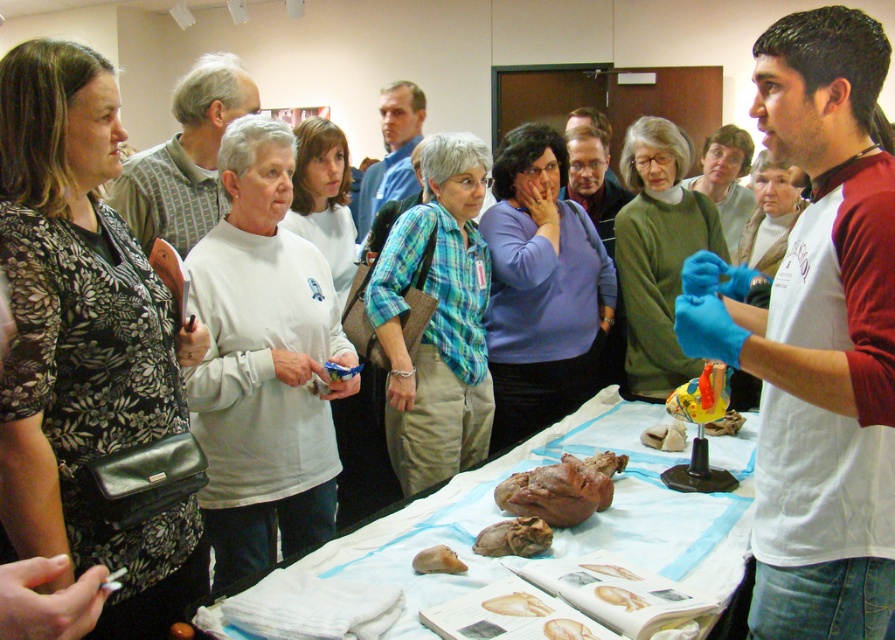
Question: Based on their relative distances, which object is farther from the brown matte bread at center?

Choices:
 (A) yellowish matte bone at center
 (B) brown rubbery heart at center
 (C) brown leather organ at center

Answer: (A)

Question: Is blue shirt at center below brown leather organ at center?

Choices:
 (A) no
 (B) yes

Answer: (A)

Question: Does brown leather organ at center appear over brown leather bone at center?

Choices:
 (A) no
 (B) yes

Answer: (A)

Question: Among these points, which one is farthest from the camera?

Choices:
 (A) (719, 419)
 (B) (655, 444)
 (C) (433, 548)

Answer: (A)

Question: In this image, where is gray knit sweater at upper center located relative to matte blue shirt at center?

Choices:
 (A) above
 (B) below

Answer: (B)

Question: Which point is closer to the camera taking this photo?

Choices:
 (A) (669, 448)
 (B) (740, 424)
 (C) (517, 604)
 (D) (604, 218)

Answer: (C)